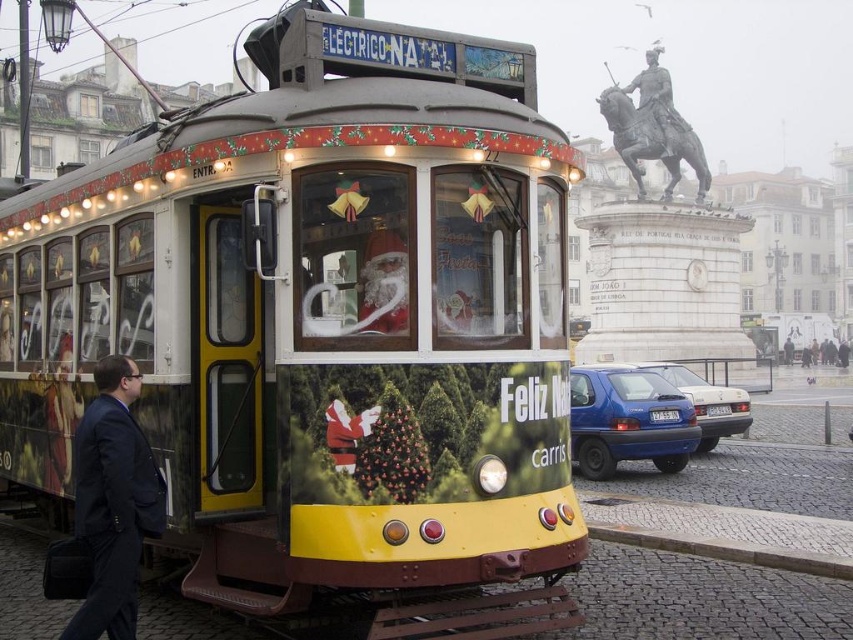
Is dark blue suit at left below bronze statue of man on horse at upper center?

Indeed, dark blue suit at left is positioned under bronze statue of man on horse at upper center.

Locate an element on the screen. dark blue suit at left is located at coordinates (113, 500).

Between point (137, 374) and point (659, 88), which one is positioned in front?

Point (137, 374) is more forward.

The width and height of the screenshot is (853, 640). Find the location of `dark blue suit at left`. dark blue suit at left is located at coordinates (113, 500).

Between bronze statue of man on horse at upper center and red velvet santa at center, which one appears on the right side from the viewer's perspective?

bronze statue of man on horse at upper center is more to the right.

Is point (672, 134) less distant than point (337, 435)?

No, (672, 134) is behind (337, 435).

Find the location of a particular element. This screenshot has height=640, width=853. bronze statue of man on horse at upper center is located at coordinates (654, 97).

Locate an element on the screen. bronze statue of man on horse at upper center is located at coordinates (654, 97).

Which of these two, dark blue suit at left or red velvet santa at center, stands shorter?

With less height is red velvet santa at center.

Who is positioned more to the right, dark blue suit at left or red velvet santa at center?

red velvet santa at center

Locate an element on the screen. dark blue suit at left is located at coordinates (113, 500).